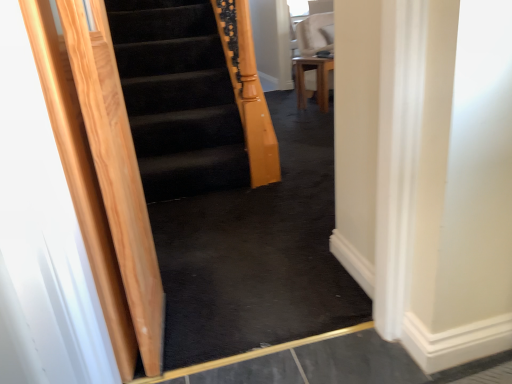
The width and height of the screenshot is (512, 384). What are the coordinates of `natural wood door at left` in the screenshot? It's located at pyautogui.click(x=117, y=172).

Image resolution: width=512 pixels, height=384 pixels. Describe the element at coordinates (117, 172) in the screenshot. I see `natural wood door at left` at that location.

Locate an element on the screen. The image size is (512, 384). natural wood door at left is located at coordinates (117, 172).